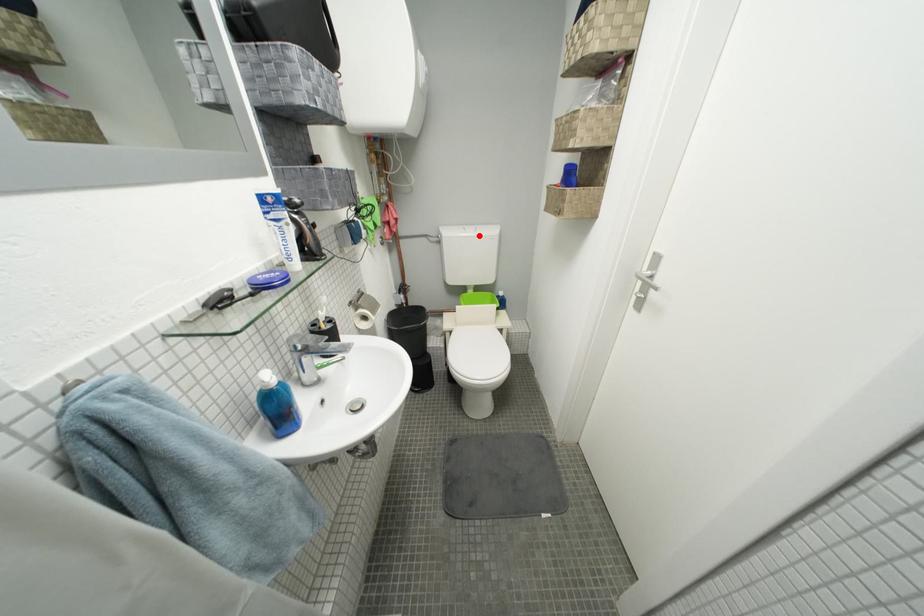
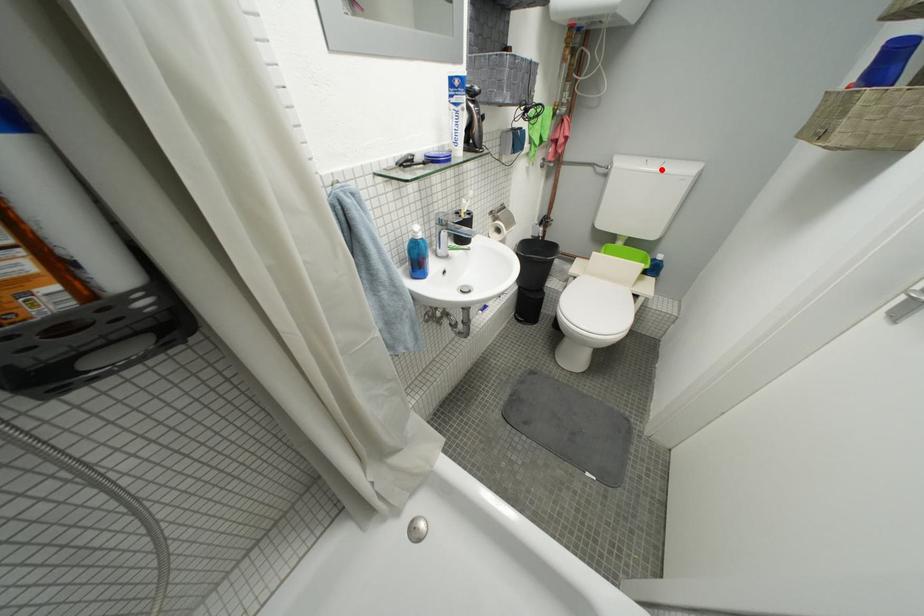
I am providing you with two images of the same scene from different viewpoints. A red point is marked on the first image and another point is marked on the second image. Is the marked point in image1 the same physical position as the marked point in image2?

Yes